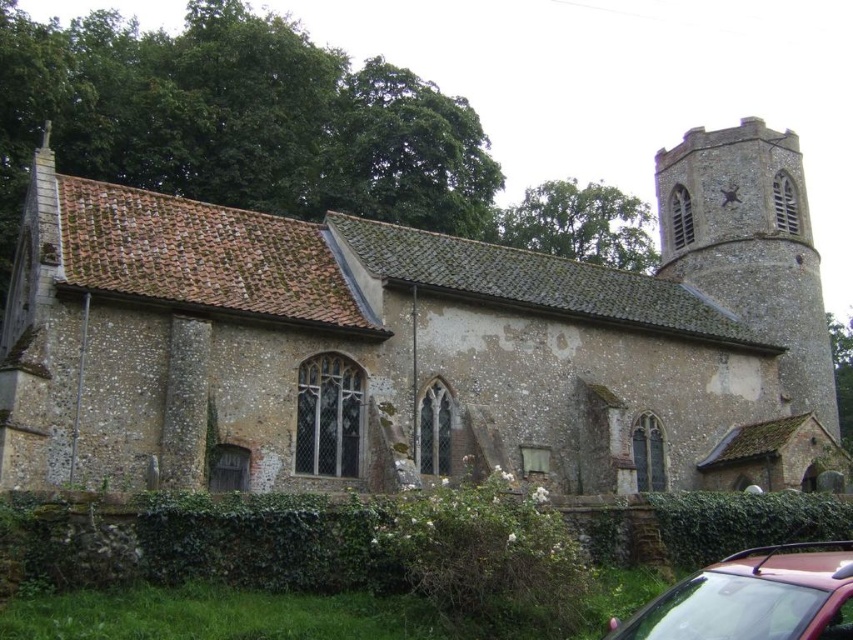
Question: Does stone church at center have a smaller size compared to stone steeple at upper right?

Choices:
 (A) no
 (B) yes

Answer: (A)

Question: Which object is closer to the camera taking this photo?

Choices:
 (A) stone steeple at upper right
 (B) shiny red car at lower right

Answer: (B)

Question: Can you confirm if stone steeple at upper right is positioned above shiny red car at lower right?

Choices:
 (A) yes
 (B) no

Answer: (A)

Question: Observing the image, what is the correct spatial positioning of stone church at center in reference to stone steeple at upper right?

Choices:
 (A) above
 (B) below

Answer: (B)

Question: Estimate the real-world distances between objects in this image. Which object is closer to the stone steeple at upper right?

Choices:
 (A) stone church at center
 (B) shiny red car at lower right

Answer: (A)

Question: Which point appears farthest from the camera in this image?

Choices:
 (A) (753, 284)
 (B) (265, 212)

Answer: (B)